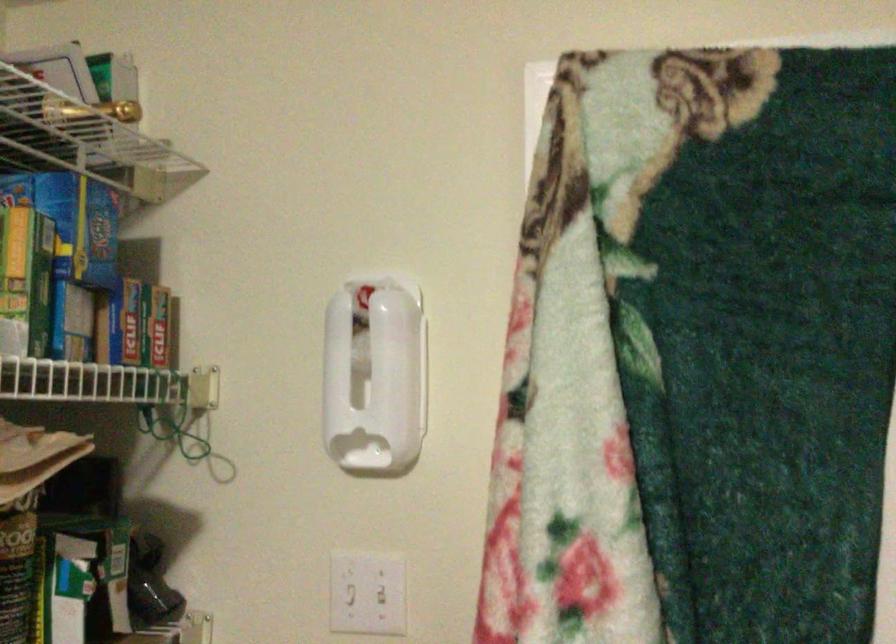
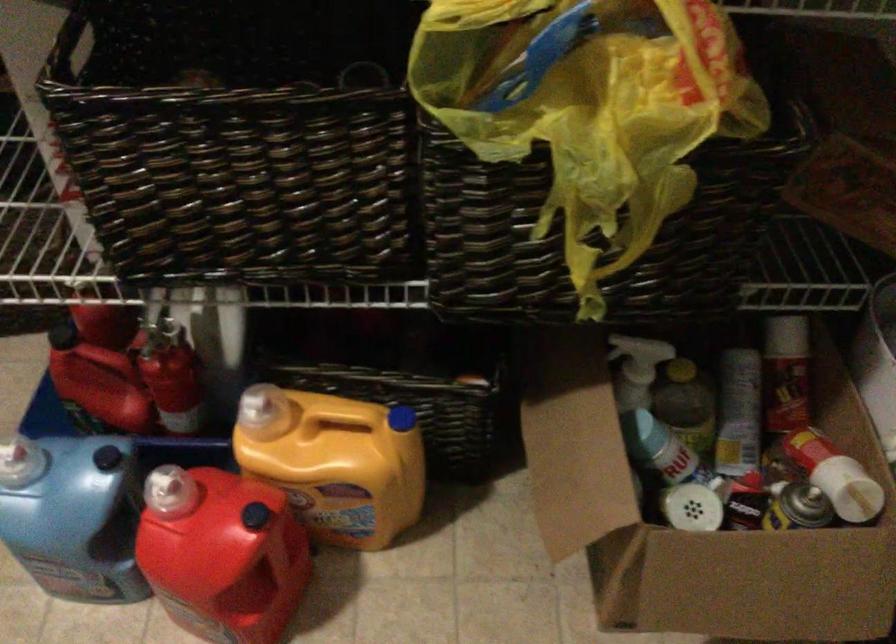
First-person continuous shooting, in which direction is the camera rotating?

The rotation direction of the camera is left-down.